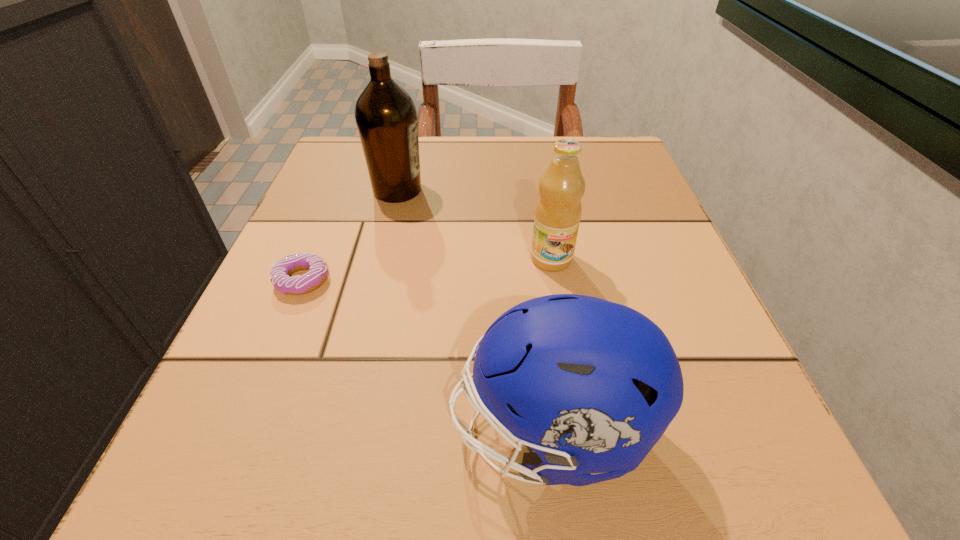
Where is `the farther olive oil`? The image size is (960, 540). the farther olive oil is located at coordinates (386, 117).

The image size is (960, 540). Find the location of `the tallest object`. the tallest object is located at coordinates (386, 117).

At what (x,y) coordinates should I click in order to perform the action: click on the shorter olive oil. Please return your answer as a coordinate pair (x, y). The image size is (960, 540). Looking at the image, I should click on click(x=561, y=187).

Identify the location of the nearer olive oil. (561, 187).

This screenshot has width=960, height=540. I want to click on football helmet, so click(x=589, y=385).

The width and height of the screenshot is (960, 540). Identify the location of the shortest object. [280, 271].

Find the location of a particular element. doughnut is located at coordinates (280, 271).

Where is `free spot located 0.340m on the label of the second object from left to right`? Image resolution: width=960 pixels, height=540 pixels. free spot located 0.340m on the label of the second object from left to right is located at coordinates (596, 190).

You are a GUI agent. You are given a task and a screenshot of the screen. Output one action in this format:
    pyautogui.click(x=<x>, y=<y>)
    Task: Click on the vacant region located on the label of the shorter olive oil
    This screenshot has height=540, width=960.
    Given the screenshot: What is the action you would take?
    pyautogui.click(x=570, y=368)

Locate an element on the screen. The image size is (960, 540). free point located on the front-facing side of the nearest object is located at coordinates (373, 431).